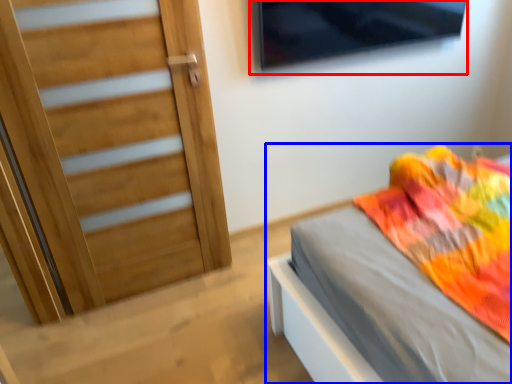
Question: Which object appears farthest to the camera in this image, window (highlighted by a red box) or bed (highlighted by a blue box)?

Choices:
 (A) window
 (B) bed

Answer: (A)